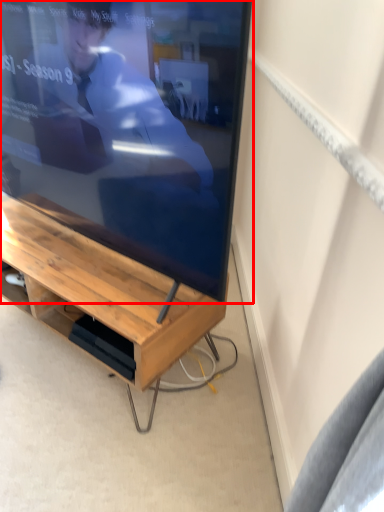
Question: Considering the relative positions of television (annotated by the red box) and desk in the image provided, where is television (annotated by the red box) located with respect to the staircase?

Choices:
 (A) left
 (B) right

Answer: (B)